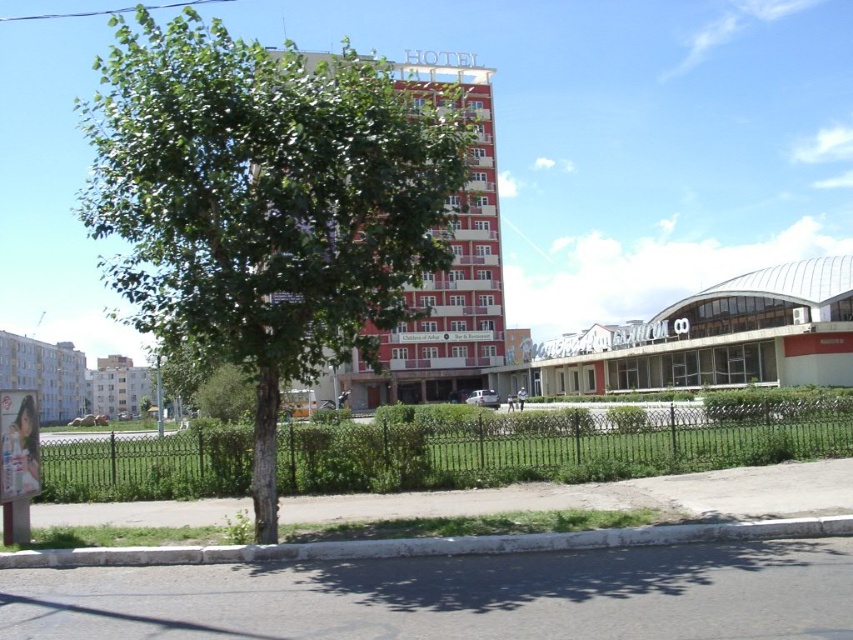
Question: Estimate the real-world distances between objects in this image. Which object is farther from the white concrete curb at lower center?

Choices:
 (A) white concrete building at left
 (B) white concrete building at lower left
 (C) red brick building at center

Answer: (B)

Question: Can you confirm if green leafy tree at left is wider than white concrete building at lower left?

Choices:
 (A) yes
 (B) no

Answer: (A)

Question: Which point appears closest to the camera in this image?

Choices:
 (A) (136, 406)
 (B) (440, 344)
 (C) (717, 292)

Answer: (C)

Question: Which object appears closest to the camera in this image?

Choices:
 (A) red glass building at lower right
 (B) white concrete building at lower left
 (C) white concrete curb at lower center

Answer: (C)

Question: Does green leafy tree at left lie behind white concrete building at lower left?

Choices:
 (A) no
 (B) yes

Answer: (A)

Question: Does green wrought iron fence at lower center have a greater width compared to red brick building at center?

Choices:
 (A) no
 (B) yes

Answer: (B)